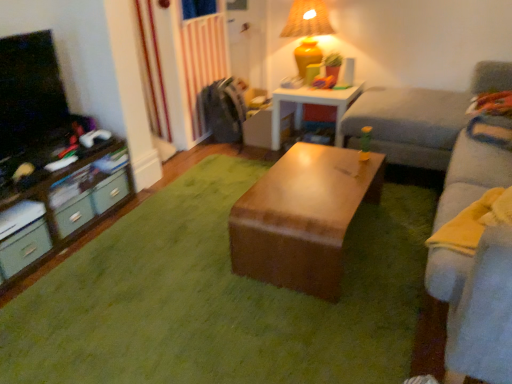
The width and height of the screenshot is (512, 384). In order to click on space that is in front of green plastic drawer at left, acting as the 1th drawer starting from the back in this screenshot , I will do `click(116, 225)`.